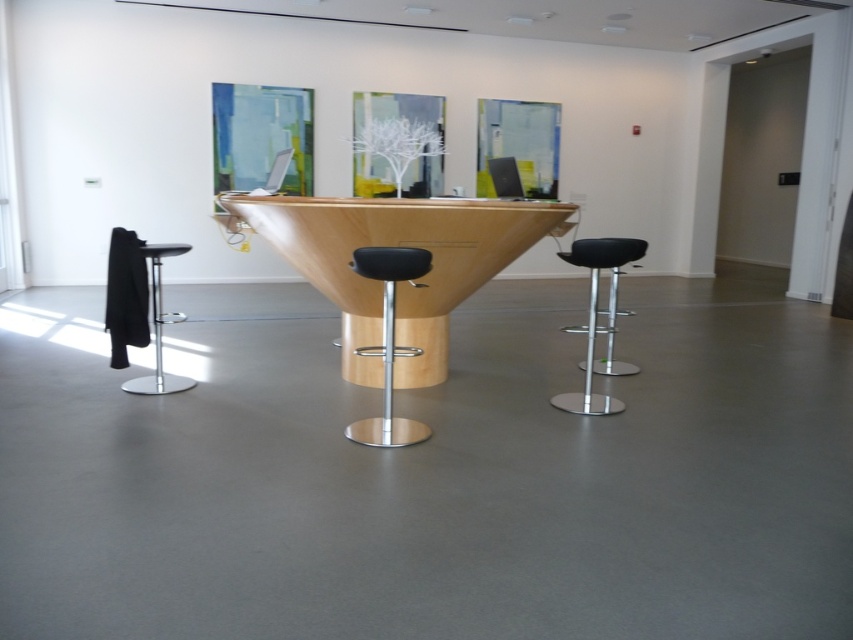
You are sitting at the central table and want to move to the black leather bar stool at right. Which direction should you move relative to the black leather bar stool at center?

You should move to the right relative to the black leather bar stool at center because the black leather bar stool at right is positioned to the right of the black leather bar stool at center.

You are sitting at the black leather bar stool at center and want to move to the black leather bar stool at right. Which direction should you move to reach it?

The black leather bar stool at center is in front of the black leather bar stool at right, so to reach the black leather bar stool at right, you should move backward.

You are a delivery person who needs to place a rectangular package that is 40 inches long between the black leather bar stool at center and the black leather bar stool at right. Can the package fit between them without bending?

The distance between the black leather bar stool at center and the black leather bar stool at right is 35.74 inches. Since the package is 40 inches long, it cannot fit between them without bending.